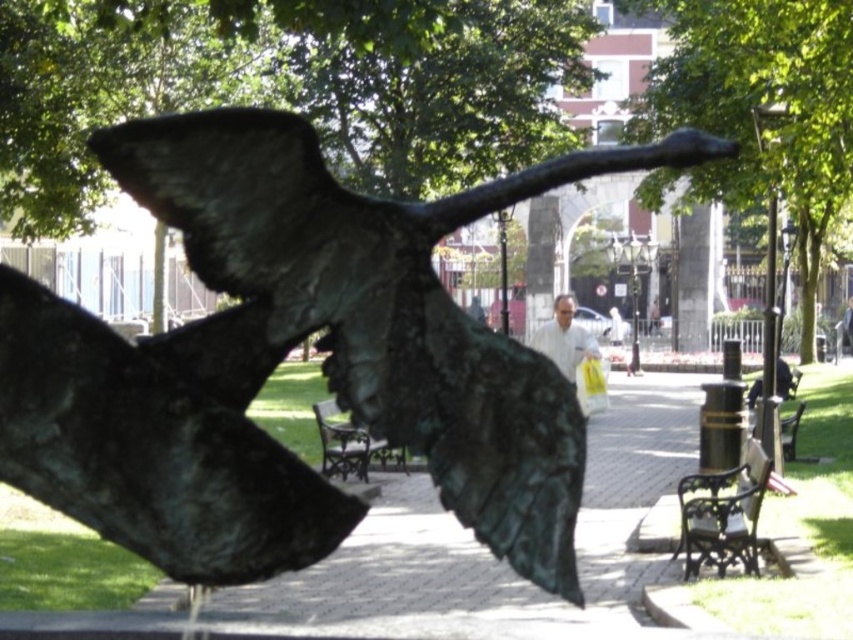
Question: Which object appears closest to the camera in this image?

Choices:
 (A) bronze wrought iron bench at lower right
 (B) wooden park bench at lower right
 (C) bronze textured wing at center

Answer: (C)

Question: Does bronze sculpture at center have a lesser width compared to wooden park bench at lower right?

Choices:
 (A) yes
 (B) no

Answer: (B)

Question: Does bronze sculpture at center appear over wooden park bench at lower right?

Choices:
 (A) yes
 (B) no

Answer: (A)

Question: Which object is positioned closest to the wooden park bench at center?

Choices:
 (A) bronze sculpture at center
 (B) wooden park bench at lower right

Answer: (B)

Question: Among these points, which one is nearest to the camera?

Choices:
 (A) (318, 321)
 (B) (340, 468)
 (C) (798, 412)
 (D) (548, 340)

Answer: (A)

Question: Can you confirm if bronze wrought iron bench at lower right is positioned to the left of wooden park bench at center?

Choices:
 (A) no
 (B) yes

Answer: (A)